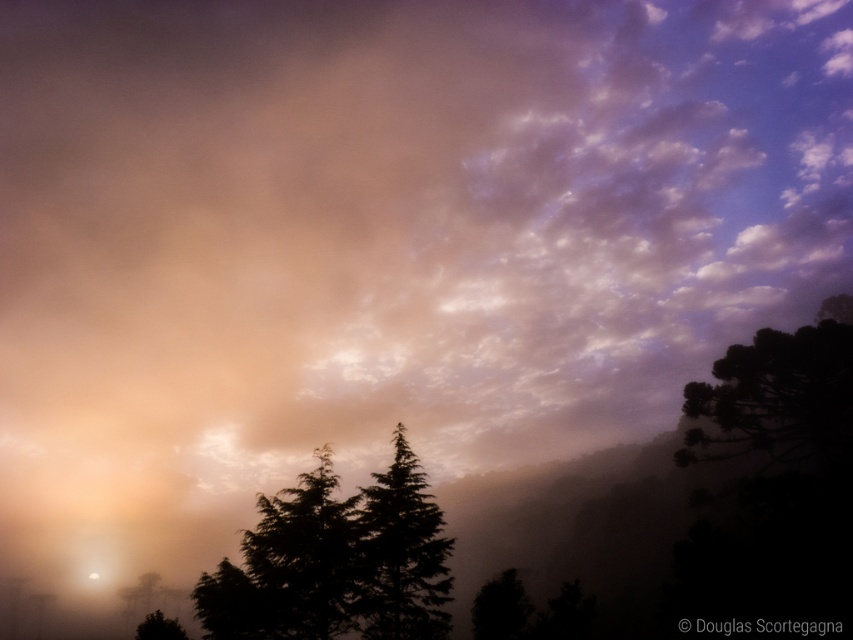
Question: Which point is farther to the camera?

Choices:
 (A) dark green textured tree at center
 (B) dark green leafy tree at lower left
 (C) dark green leafy tree at lower right

Answer: (B)

Question: Is dark green textured tree at center behind silhouette evergreen tree at center?

Choices:
 (A) yes
 (B) no

Answer: (A)

Question: Considering the real-world distances, which object is farthest from the dark green leafy tree at lower left?

Choices:
 (A) dark green textured tree at right
 (B) silhouette evergreen tree at center
 (C) dark green textured tree at center
 (D) silhouette/transparent tree at center

Answer: (A)

Question: Is silhouette evergreen tree at center above dark green leafy tree at lower left?

Choices:
 (A) no
 (B) yes

Answer: (B)

Question: Which of the following is the farthest from the observer?

Choices:
 (A) dark green textured tree at right
 (B) dark green leafy tree at lower right
 (C) dark green textured tree at center
 (D) silhouette evergreen tree at center

Answer: (A)

Question: Is dark green textured tree at center positioned at the back of dark green leafy tree at lower left?

Choices:
 (A) yes
 (B) no

Answer: (B)